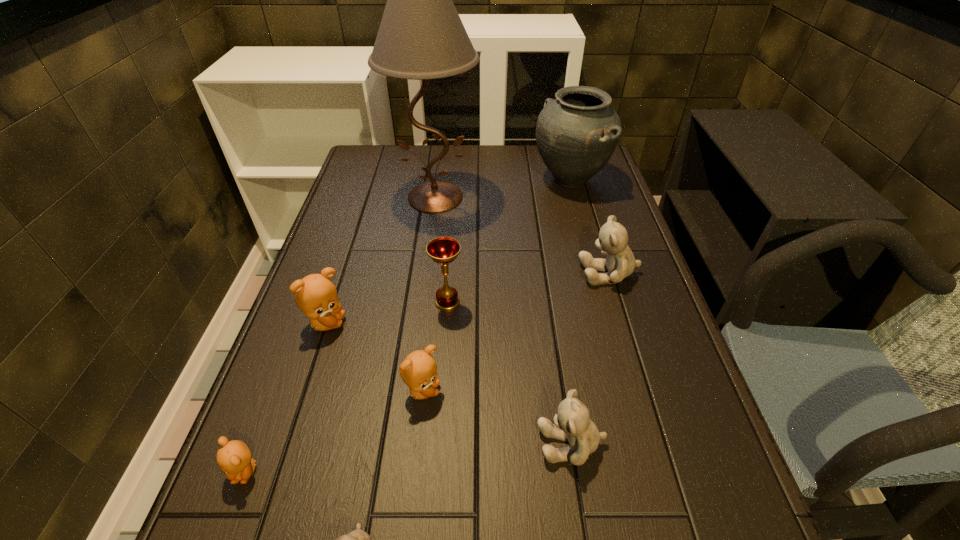
The width and height of the screenshot is (960, 540). Identify the location of the second gray teddy bear from right to left. (572, 423).

Find the location of `the second farthest gray teddy bear`. the second farthest gray teddy bear is located at coordinates (572, 423).

Find the location of `the smallest brown teddy bear`. the smallest brown teddy bear is located at coordinates pos(234,457).

You are a GUI agent. You are given a task and a screenshot of the screen. Output one action in this format:
    pyautogui.click(x=<x>, y=<y>)
    Task: Click on the vacant space positioned on the front-facing side of the tallest object
    The image size is (960, 540).
    Given the screenshot: What is the action you would take?
    pyautogui.click(x=429, y=247)

The image size is (960, 540). In order to click on free location located on the front of the second tallest object in this screenshot , I will do `click(581, 220)`.

I want to click on free space located on the right of the chalice, so click(x=625, y=302).

This screenshot has height=540, width=960. Identify the location of free region located on the face of the second farthest teddy bear. (524, 323).

Locate an element on the screen. The height and width of the screenshot is (540, 960). free space located 0.390m on the face of the farthest gray teddy bear is located at coordinates (423, 273).

Where is `vacant space situated on the face of the farthest gray teddy bear`? Image resolution: width=960 pixels, height=540 pixels. vacant space situated on the face of the farthest gray teddy bear is located at coordinates (503, 273).

Find the location of a particular element. free space located 0.090m on the face of the farthest gray teddy bear is located at coordinates (543, 273).